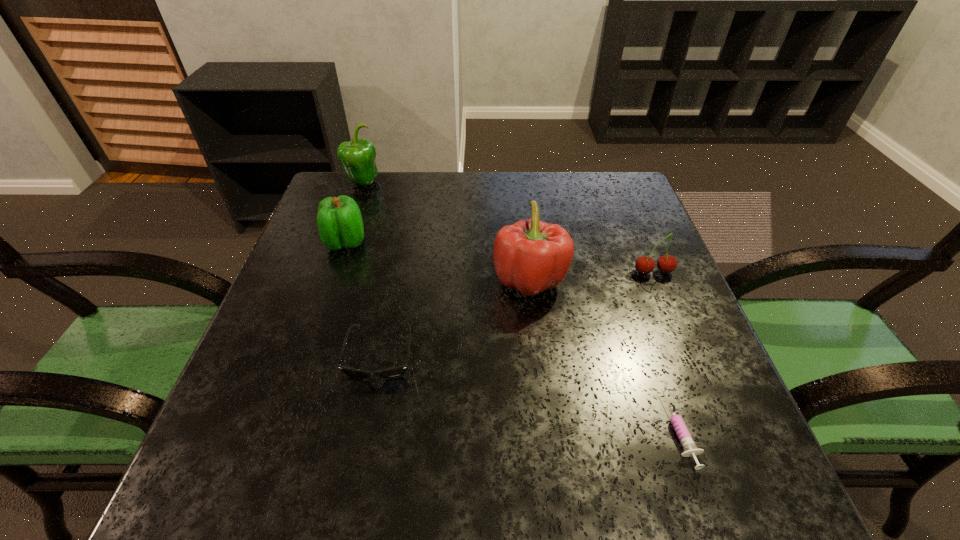
Locate an element on the screen. This screenshot has width=960, height=540. vacant space located on the front of the shortest bell pepper is located at coordinates pyautogui.click(x=314, y=335).

Find the location of a particular element. This screenshot has width=960, height=540. blank space located 0.230m on the surface of the cherry is located at coordinates (690, 362).

Find the location of a particular element. The image size is (960, 540). free space located on the front-facing side of the fifth tallest object is located at coordinates click(x=365, y=436).

The width and height of the screenshot is (960, 540). What are the coordinates of `vacant space located 0.380m on the back of the shortest object` in the screenshot? It's located at (620, 254).

This screenshot has height=540, width=960. Identify the location of object that is positioned at the far edge. (357, 157).

The image size is (960, 540). I want to click on object located in the near edge section of the desktop, so click(684, 436).

You are a GUI agent. You are given a task and a screenshot of the screen. Output one action in this format:
    pyautogui.click(x=<x>, y=<y>)
    Task: Click on the cherry at the right edge
    
    Given the screenshot: What is the action you would take?
    pyautogui.click(x=667, y=263)

Where is `syringe present at the right edge`? The image size is (960, 540). syringe present at the right edge is located at coordinates (684, 436).

Identify the location of object located in the far left corner section of the desktop. (357, 157).

Where is `object that is at the near right corner`? Image resolution: width=960 pixels, height=540 pixels. object that is at the near right corner is located at coordinates (684, 436).